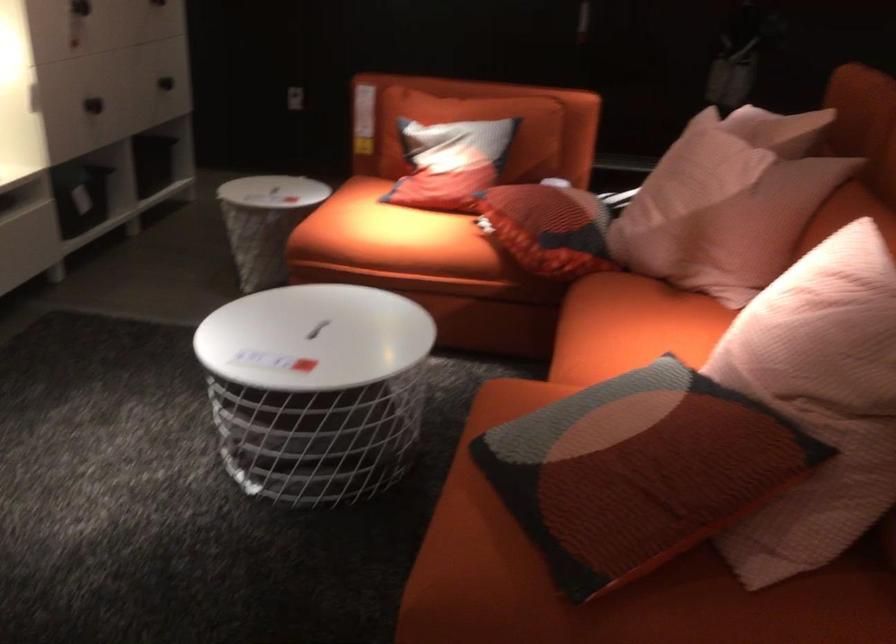
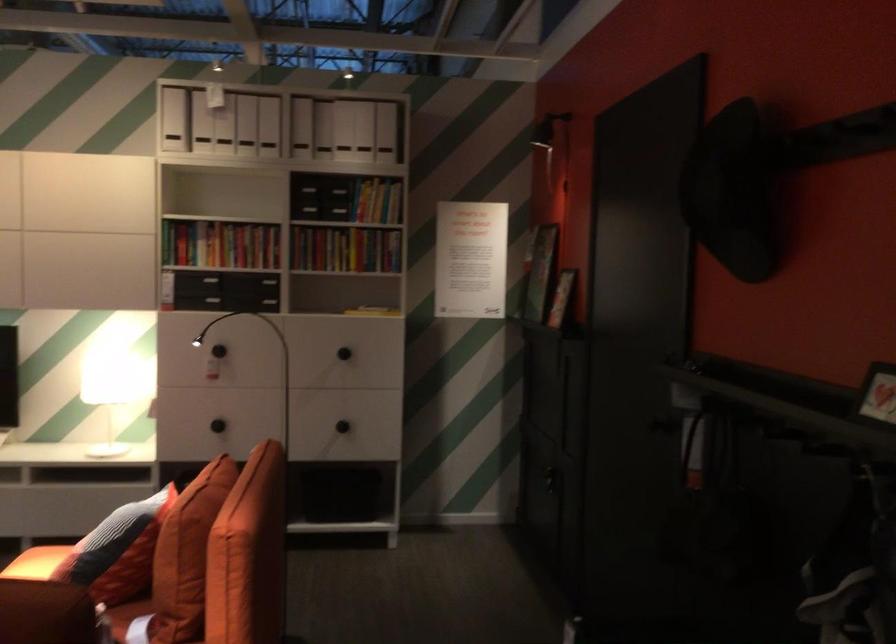
Locate, in the second image, the point that corresponds to pixel 187 73 in the first image.

(341, 426)